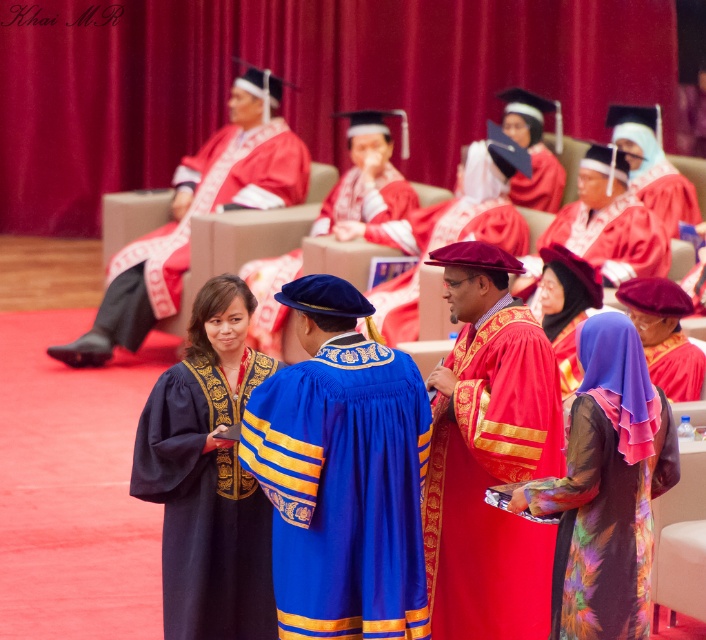
Question: Observing the image, what is the correct spatial positioning of velvet blue graduation gown at center in reference to purple satin hijab at center?

Choices:
 (A) left
 (B) right

Answer: (A)

Question: Which object is the farthest from the velvet maroon graduation gown at center?

Choices:
 (A) blue velvet gown at center
 (B) purple satin hijab at center

Answer: (B)

Question: Can you confirm if matte red gown at upper left is positioned below purple satin hijab at center?

Choices:
 (A) yes
 (B) no

Answer: (B)

Question: Is matte red gown at upper left to the left of purple satin hijab at center from the viewer's perspective?

Choices:
 (A) yes
 (B) no

Answer: (A)

Question: Which point is closer to the camera?

Choices:
 (A) (561, 273)
 (B) (484, 625)
 (C) (357, 156)
 (D) (193, 448)

Answer: (B)

Question: Which point is closer to the camera taking this photo?

Choices:
 (A) (345, 403)
 (B) (205, 282)

Answer: (A)